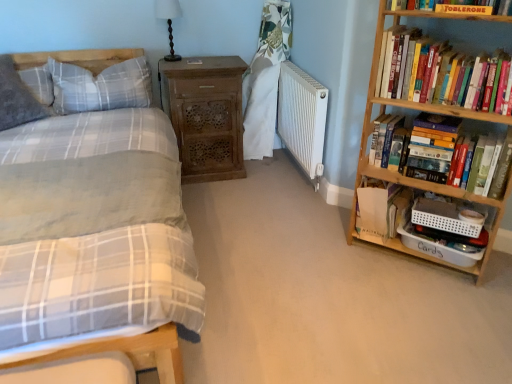
Find the location of a particular element. Image resolution: width=512 pixels, height=384 pixels. vacant space that is in between wooden carved nightstand at left and white plastic basket at lower right is located at coordinates (273, 202).